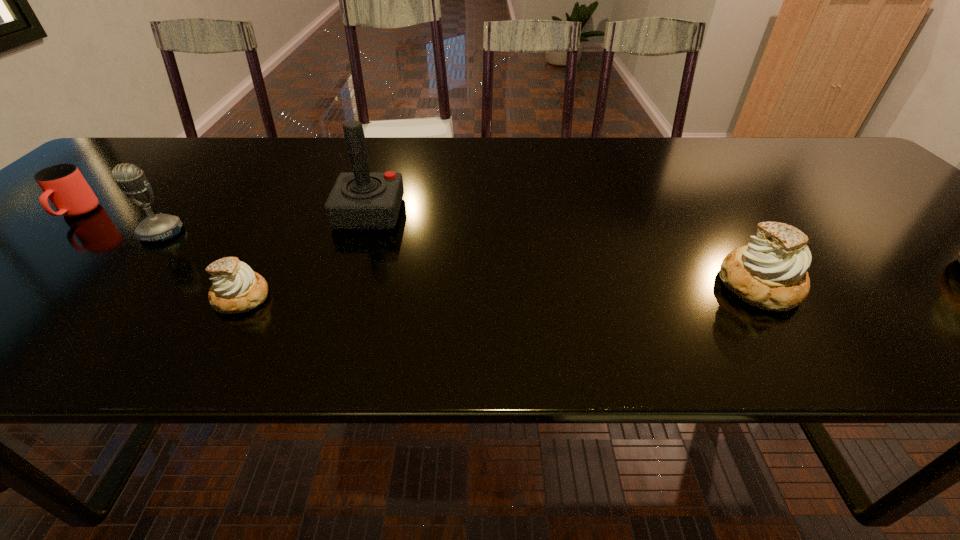
Please mark a free spot for a new pastry to balance the arrangement. Please provide its 2D coordinates. Your answer should be formatted as a tuple, i.e. [(x, y)], where the tuple contains the x and y coordinates of a point satisfying the conditions above.

[(505, 291)]